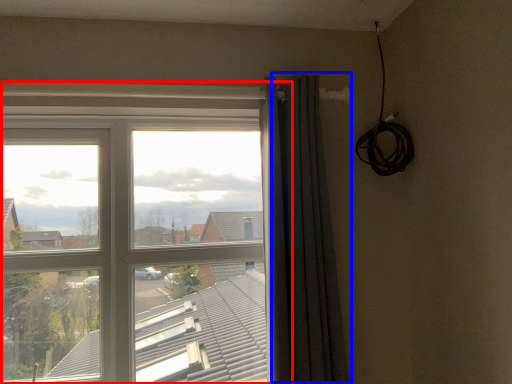
Question: Among these objects, which one is nearest to the camera, window (highlighted by a red box) or curtain (highlighted by a blue box)?

Choices:
 (A) window
 (B) curtain

Answer: (B)